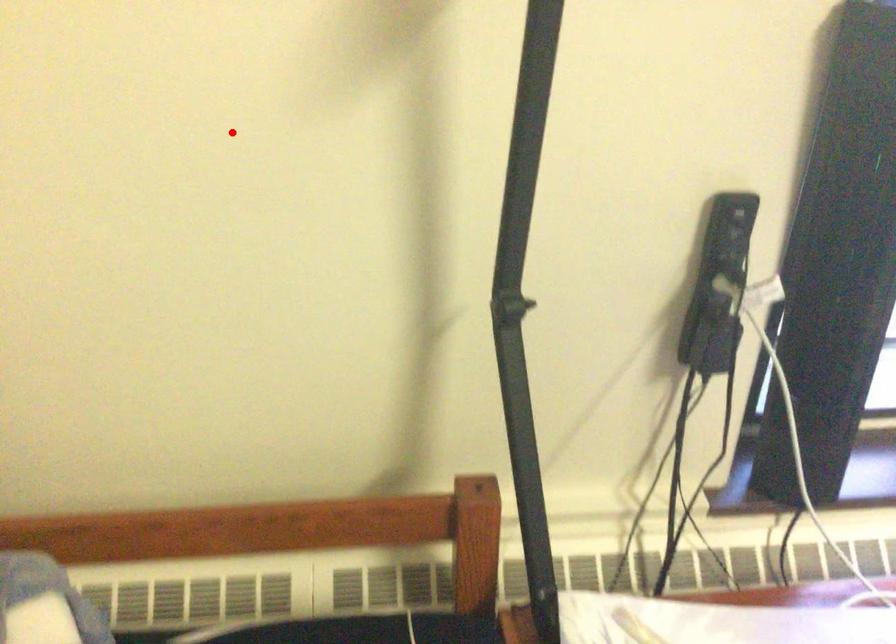
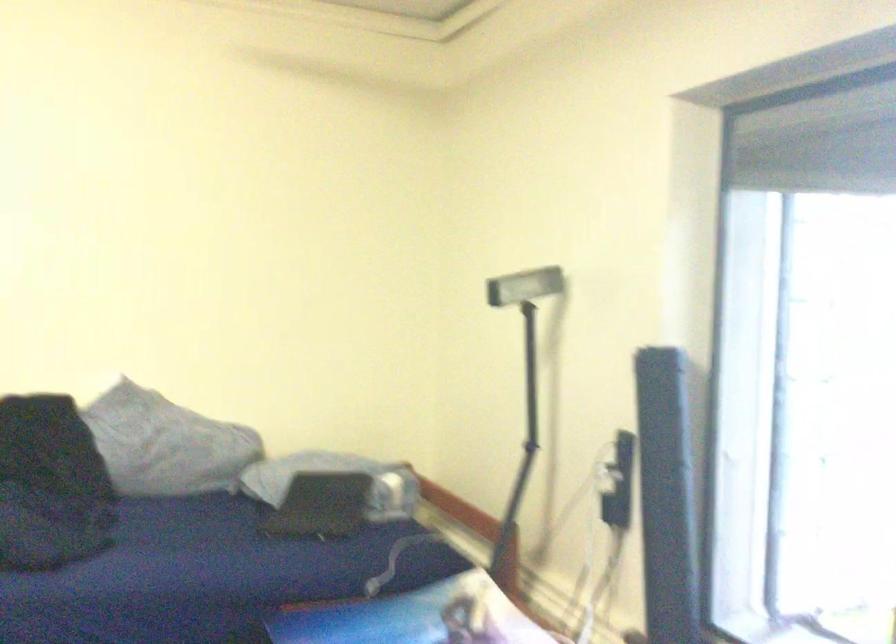
Locate, in the second image, the point that corresponds to the highlighted location in the first image.

(522, 377)